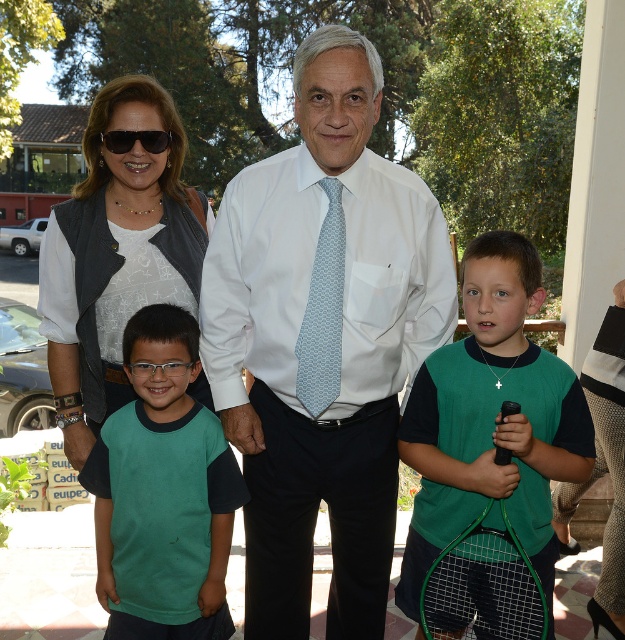
Between white silk shirt at center and green matte t-shirt at center, which one has less height?

With less height is green matte t-shirt at center.

Who is more forward, (x=451, y=310) or (x=218, y=468)?

Point (x=451, y=310)

Where is `white silk shirt at center`? Image resolution: width=625 pixels, height=640 pixels. white silk shirt at center is located at coordinates (322, 340).

Is matte black vest at left wider than green mesh tennis racket at lower center?

Yes.

Is matte black vest at left thinner than green mesh tennis racket at lower center?

Incorrect, matte black vest at left's width is not less than green mesh tennis racket at lower center's.

Where is `matte black vest at left`? Image resolution: width=625 pixels, height=640 pixels. matte black vest at left is located at coordinates (116, 256).

Who is lower down, green jersey at center or light blue textured tie at center?

green jersey at center is lower down.

This screenshot has height=640, width=625. What do you see at coordinates (491, 419) in the screenshot? I see `green jersey at center` at bounding box center [491, 419].

This screenshot has width=625, height=640. What are the coordinates of `green jersey at center` in the screenshot? It's located at (491, 419).